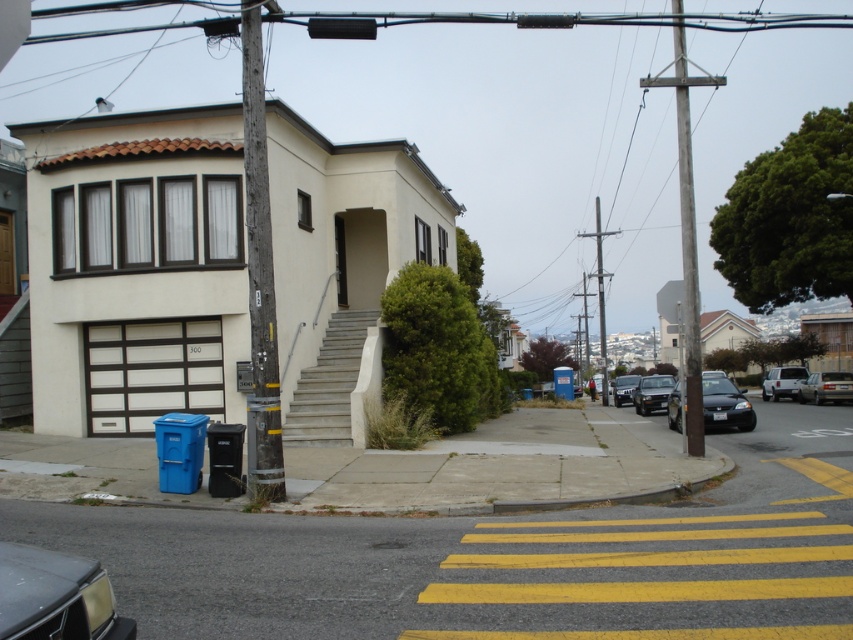
Is weathered wood pole at left positioned at the back of shiny black car at center-right?

No, it is in front of shiny black car at center-right.

The width and height of the screenshot is (853, 640). What do you see at coordinates (259, 276) in the screenshot?
I see `weathered wood pole at left` at bounding box center [259, 276].

Locate an element on the screen. The height and width of the screenshot is (640, 853). weathered wood pole at left is located at coordinates (259, 276).

Is silver metallic sedan at lower right positioned in front of metallic gray utility pole at center-right?

Yes.

The height and width of the screenshot is (640, 853). What do you see at coordinates (827, 387) in the screenshot? I see `silver metallic sedan at lower right` at bounding box center [827, 387].

This screenshot has width=853, height=640. Find the location of `silver metallic sedan at lower right`. silver metallic sedan at lower right is located at coordinates (827, 387).

Who is positioned more to the right, shiny black sedan at center-right or metallic gray utility pole at center-right?

From the viewer's perspective, metallic gray utility pole at center-right appears more on the right side.

Between point (712, 388) and point (607, 378), which one is positioned in front?

Positioned in front is point (712, 388).

In order to click on shiny black sedan at center-right in this screenshot , I will do `click(724, 404)`.

Locate an element on the screen. This screenshot has height=640, width=853. shiny black sedan at center-right is located at coordinates (724, 404).